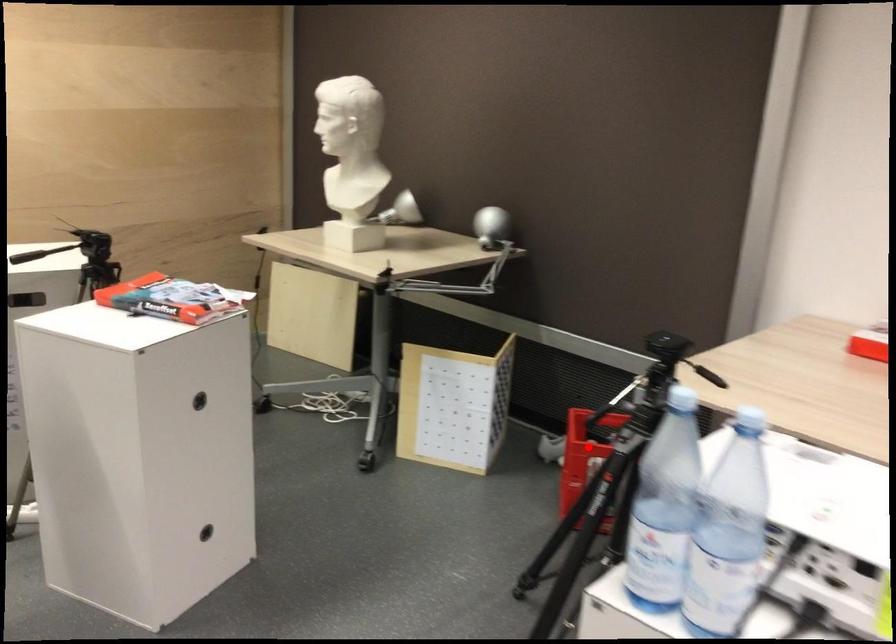
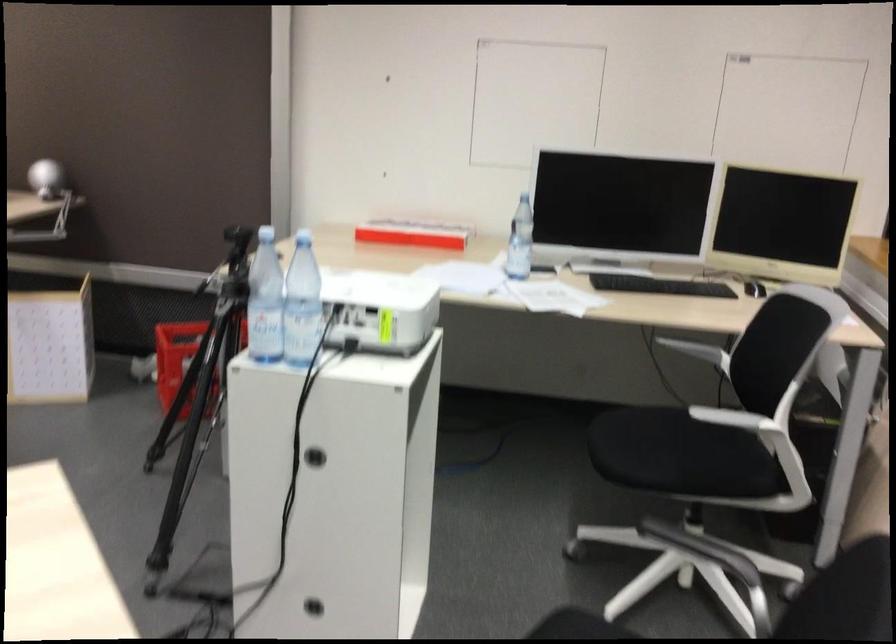
Where in the second image is the point corresponding to the highlighted location from the first image?

(179, 359)